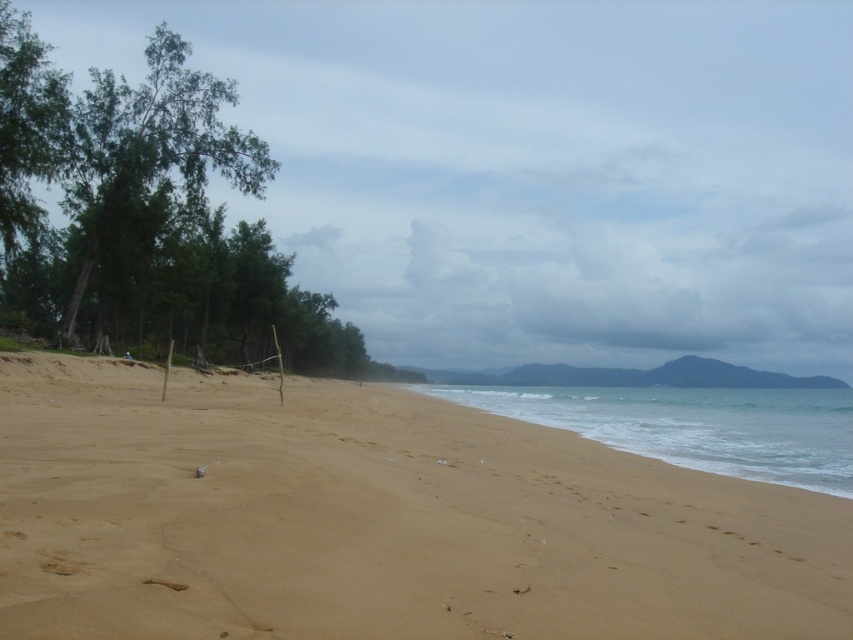
Can you confirm if green leafy tree at left is thinner than clear water at lower center?

Indeed, green leafy tree at left has a lesser width compared to clear water at lower center.

Does green leafy tree at left have a larger size compared to clear water at lower center?

Yes, green leafy tree at left is bigger than clear water at lower center.

Find the location of a particular element. This screenshot has width=853, height=640. green leafy tree at left is located at coordinates (x=148, y=216).

Between clear water at lower center and brown sandy footprint at lower center, which one is positioned higher?

brown sandy footprint at lower center is higher up.

Is clear water at lower center smaller than brown sandy footprint at lower center?

Incorrect, clear water at lower center is not smaller in size than brown sandy footprint at lower center.

Does point (779, 392) come closer to viewer compared to point (167, 582)?

No, it is behind (167, 582).

What are the coordinates of `clear water at lower center` in the screenshot? It's located at (695, 426).

Does sandy beach at lower left have a greater width compared to clear water at lower center?

Incorrect, sandy beach at lower left's width does not surpass clear water at lower center's.

Does sandy beach at lower left appear under clear water at lower center?

No, sandy beach at lower left is not below clear water at lower center.

Is point (125, 509) in front of point (637, 392)?

That is True.

Find the location of a particular element. Image resolution: width=853 pixels, height=640 pixels. sandy beach at lower left is located at coordinates 376,520.